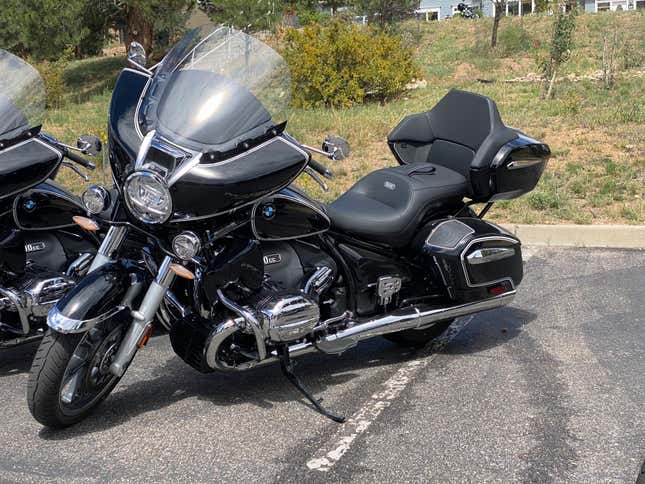
Locate an element on the screen. The width and height of the screenshot is (645, 484). light is located at coordinates (150, 198), (97, 199), (186, 251).